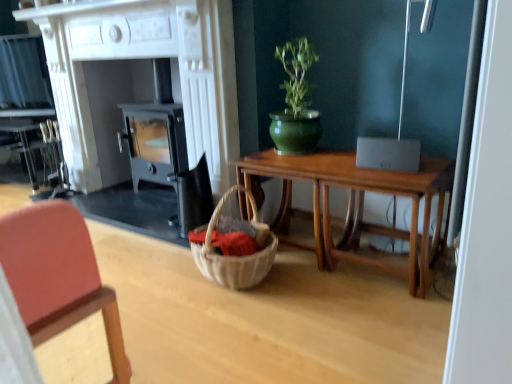
Question: From their relative heights in the image, would you say white wood fireplace at center is taller or shorter than green glossy vase at upper center?

Choices:
 (A) tall
 (B) short

Answer: (A)

Question: Looking at the image, does white wood fireplace at center seem bigger or smaller compared to green glossy vase at upper center?

Choices:
 (A) small
 (B) big

Answer: (B)

Question: Which object is positioned closest to the white wood fireplace at center?

Choices:
 (A) green glossy vase at upper center
 (B) wooden table at center

Answer: (A)

Question: Which object is the farthest from the wooden table at center?

Choices:
 (A) green glossy vase at upper center
 (B) white wood fireplace at center

Answer: (B)